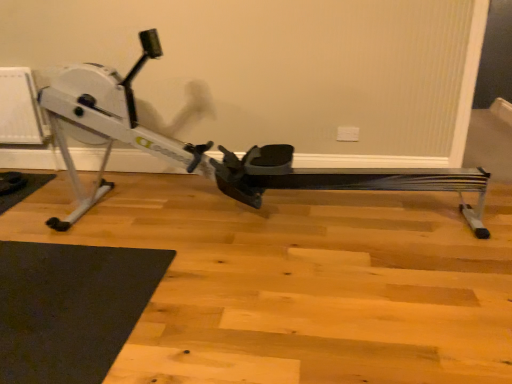
What do you see at coordinates (20, 109) in the screenshot?
I see `white plastic radiator at left` at bounding box center [20, 109].

Where is `white plastic radiator at left`? The height and width of the screenshot is (384, 512). white plastic radiator at left is located at coordinates (20, 109).

What is the approximate height of white plastic radiator at left?

24.55 inches.

The image size is (512, 384). Identify the location of white plastic radiator at left. (20, 109).